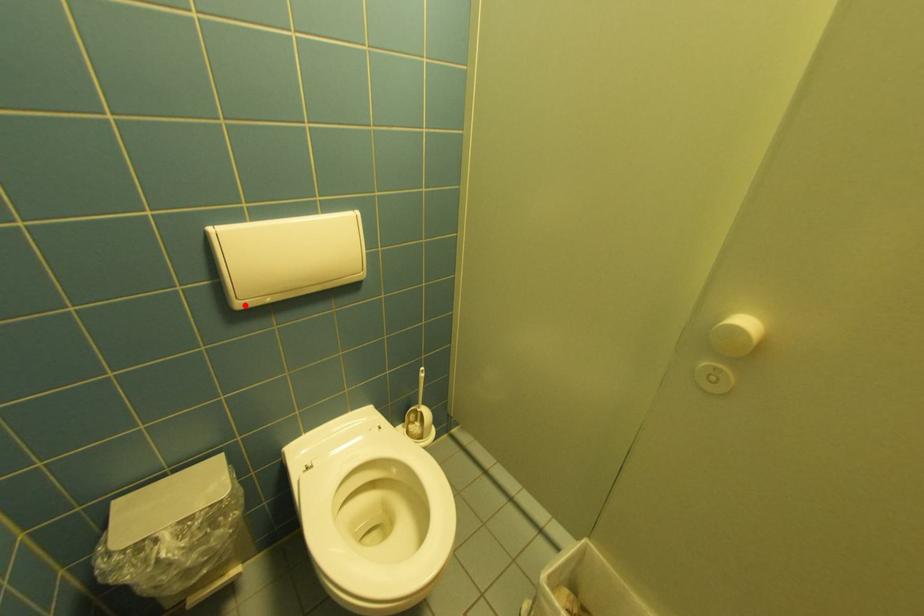
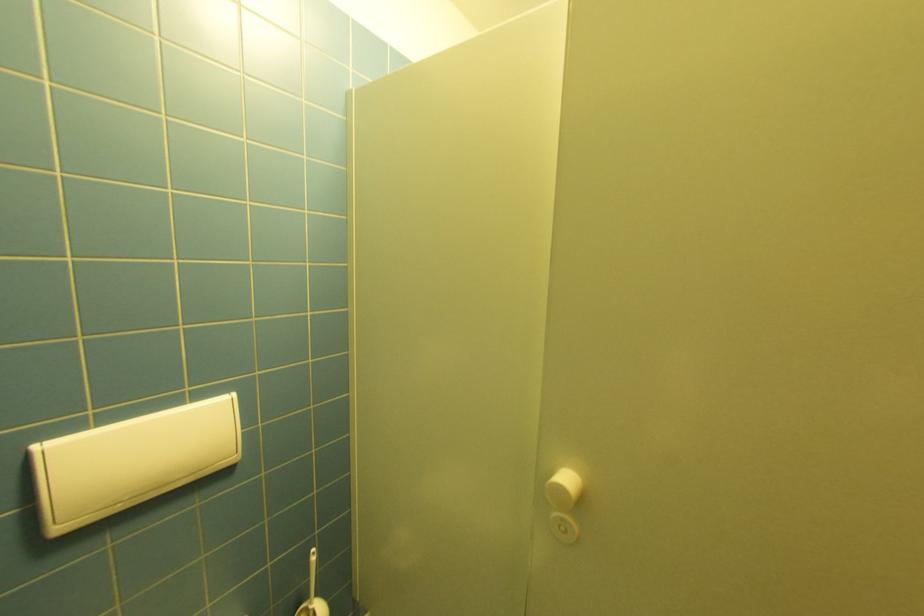
Question: I am providing you with two images of the same scene from different viewpoints. Image1 has a red point marked. In image2, the corresponding 3D location appears at what relative position? Reply with the corresponding letter.

Choices:
 (A) Closer
 (B) Farther

Answer: (B)